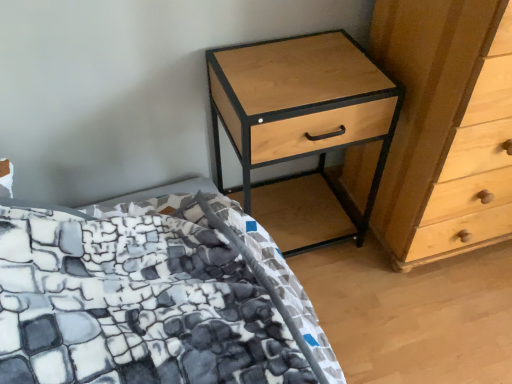
The height and width of the screenshot is (384, 512). What do you see at coordinates (303, 127) in the screenshot? I see `light wood/black metal nightstand at upper right` at bounding box center [303, 127].

What do you see at coordinates (151, 299) in the screenshot? Image resolution: width=512 pixels, height=384 pixels. I see `stone-patterned fabric bed at lower left` at bounding box center [151, 299].

This screenshot has width=512, height=384. In order to click on light wood/texture chest of drawers at right in this screenshot , I will do `click(451, 132)`.

This screenshot has height=384, width=512. Identify the location of light wood/black metal nightstand at upper right. (303, 127).

Does point (286, 42) lie in front of point (421, 109)?

No, (286, 42) is behind (421, 109).

In the scene shown: Would you say light wood/black metal nightstand at upper right is outside light wood/texture chest of drawers at right?

Absolutely, light wood/black metal nightstand at upper right is external to light wood/texture chest of drawers at right.

Between light wood/black metal nightstand at upper right and light wood/texture chest of drawers at right, which one is positioned behind?

Positioned behind is light wood/black metal nightstand at upper right.

Is light wood/black metal nightstand at upper right shorter than light wood/texture chest of drawers at right?

Indeed, light wood/black metal nightstand at upper right has a lesser height compared to light wood/texture chest of drawers at right.

From the image's perspective, would you say stone-patterned fabric bed at lower left is shown under light wood/black metal nightstand at upper right?

Correct, stone-patterned fabric bed at lower left appears lower than light wood/black metal nightstand at upper right in the image.

From the picture: Considering the sizes of objects stone-patterned fabric bed at lower left and light wood/black metal nightstand at upper right in the image provided, who is bigger, stone-patterned fabric bed at lower left or light wood/black metal nightstand at upper right?

light wood/black metal nightstand at upper right is bigger.

Is stone-patterned fabric bed at lower left positioned with its back to light wood/black metal nightstand at upper right?

No.

Are stone-patterned fabric bed at lower left and light wood/black metal nightstand at upper right located far from each other?

No.

You are a GUI agent. You are given a task and a screenshot of the screen. Output one action in this format:
    pyautogui.click(x=<x>, y=<y>)
    Task: Click on the bed on the right of light wood/black metal nightstand at upper right
    This screenshot has width=512, height=384.
    Given the screenshot: What is the action you would take?
    pyautogui.click(x=151, y=299)

Is point (328, 111) closer to viewer compared to point (152, 202)?

That is True.

Is light wood/black metal nightstand at upper right wider than stone-patterned fabric bed at lower left?

Incorrect, the width of light wood/black metal nightstand at upper right does not surpass that of stone-patterned fabric bed at lower left.

Is light wood/texture chest of drawers at right shorter than stone-patterned fabric bed at lower left?

No.

You are a GUI agent. You are given a task and a screenshot of the screen. Output one action in this format:
    pyautogui.click(x=<x>, y=<y>)
    Task: Click on the bed that is below the light wood/texture chest of drawers at right (from the image's perspective)
    This screenshot has height=384, width=512.
    Given the screenshot: What is the action you would take?
    pyautogui.click(x=151, y=299)

Can you confirm if light wood/texture chest of drawers at right is bigger than stone-patterned fabric bed at lower left?

Indeed, light wood/texture chest of drawers at right has a larger size compared to stone-patterned fabric bed at lower left.

Is light wood/texture chest of drawers at right thinner than stone-patterned fabric bed at lower left?

Indeed, light wood/texture chest of drawers at right has a lesser width compared to stone-patterned fabric bed at lower left.

Between light wood/texture chest of drawers at right and light wood/black metal nightstand at upper right, which one has more height?

light wood/texture chest of drawers at right.

Is light wood/texture chest of drawers at right oriented away from light wood/black metal nightstand at upper right?

No, light wood/texture chest of drawers at right's orientation is not away from light wood/black metal nightstand at upper right.

From a real-world perspective, relative to light wood/black metal nightstand at upper right, is light wood/texture chest of drawers at right vertically above or below?

Clearly, from a real-world perspective, light wood/texture chest of drawers at right is above light wood/black metal nightstand at upper right.

Is stone-patterned fabric bed at lower left facing away from light wood/texture chest of drawers at right?

No, stone-patterned fabric bed at lower left is not facing away from light wood/texture chest of drawers at right.

Would you say stone-patterned fabric bed at lower left is outside light wood/texture chest of drawers at right?

Indeed, stone-patterned fabric bed at lower left is completely outside light wood/texture chest of drawers at right.

Considering their positions, is stone-patterned fabric bed at lower left located in front of or behind light wood/texture chest of drawers at right?

stone-patterned fabric bed at lower left is positioned farther from the viewer than light wood/texture chest of drawers at right.

Is point (18, 204) farther from camera compared to point (432, 89)?

Yes, it is.

You are a GUI agent. You are given a task and a screenshot of the screen. Output one action in this format:
    pyautogui.click(x=<x>, y=<y>)
    Task: Click on the nightstand on the left of the light wood/texture chest of drawers at right
    This screenshot has height=384, width=512.
    Given the screenshot: What is the action you would take?
    pyautogui.click(x=303, y=127)

Locate an element on the screen. Image resolution: width=512 pixels, height=384 pixels. nightstand behind the stone-patterned fabric bed at lower left is located at coordinates (303, 127).

Considering their positions, is light wood/texture chest of drawers at right positioned closer to stone-patterned fabric bed at lower left than light wood/black metal nightstand at upper right?

light wood/black metal nightstand at upper right is positioned closer to the anchor stone-patterned fabric bed at lower left.

Based on their spatial positions, is light wood/black metal nightstand at upper right or light wood/texture chest of drawers at right closer to stone-patterned fabric bed at lower left?

light wood/black metal nightstand at upper right is closer to stone-patterned fabric bed at lower left.

When comparing their distances from light wood/texture chest of drawers at right, does stone-patterned fabric bed at lower left or light wood/black metal nightstand at upper right seem further?

stone-patterned fabric bed at lower left is further to light wood/texture chest of drawers at right.

From the image, which object appears to be nearer to light wood/texture chest of drawers at right, light wood/black metal nightstand at upper right or stone-patterned fabric bed at lower left?

light wood/black metal nightstand at upper right is closer to light wood/texture chest of drawers at right.

Consider the image. Considering their positions, is light wood/texture chest of drawers at right positioned closer to light wood/black metal nightstand at upper right than stone-patterned fabric bed at lower left?

light wood/texture chest of drawers at right is closer to light wood/black metal nightstand at upper right.

Looking at this image, considering their positions, is stone-patterned fabric bed at lower left positioned further to light wood/black metal nightstand at upper right than light wood/texture chest of drawers at right?

stone-patterned fabric bed at lower left is further to light wood/black metal nightstand at upper right.

I want to click on bed between light wood/black metal nightstand at upper right and light wood/texture chest of drawers at right in the horizontal direction, so click(x=151, y=299).